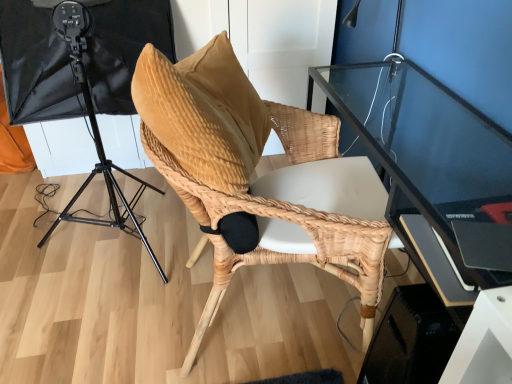
Question: From the image's perspective, is natural woven chair at center located above or below black matte tripod at left?

Choices:
 (A) above
 (B) below

Answer: (B)

Question: Considering the positions of natural woven chair at center and black matte tripod at left in the image, is natural woven chair at center taller or shorter than black matte tripod at left?

Choices:
 (A) tall
 (B) short

Answer: (B)

Question: Is natural woven chair at center wider or thinner than black matte tripod at left?

Choices:
 (A) wide
 (B) thin

Answer: (B)

Question: Is black matte tripod at left to the left or to the right of natural woven chair at center in the image?

Choices:
 (A) left
 (B) right

Answer: (A)

Question: From the image's perspective, is black matte tripod at left positioned above or below natural woven chair at center?

Choices:
 (A) above
 (B) below

Answer: (A)

Question: In terms of width, does black matte tripod at left look wider or thinner when compared to natural woven chair at center?

Choices:
 (A) wide
 (B) thin

Answer: (A)

Question: Does point (87, 112) appear closer or farther from the camera than point (186, 362)?

Choices:
 (A) farther
 (B) closer

Answer: (A)